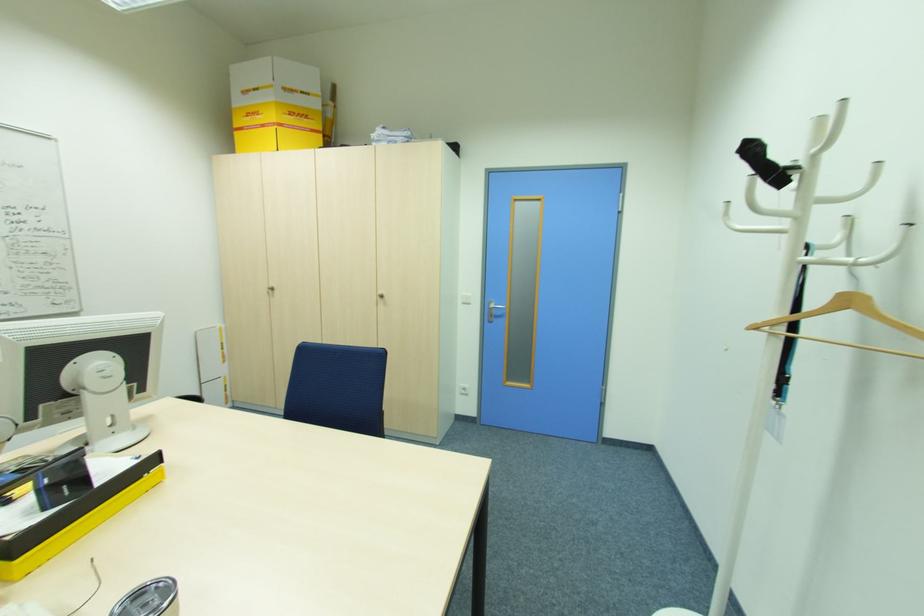
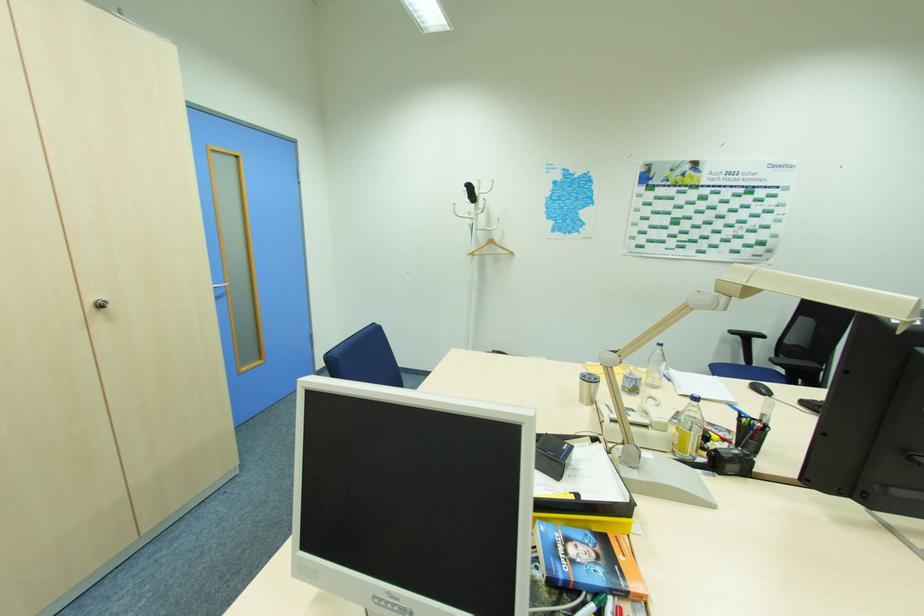
Where in the second image is the point corresponding to pixel 759 326 from the first image?

(472, 254)